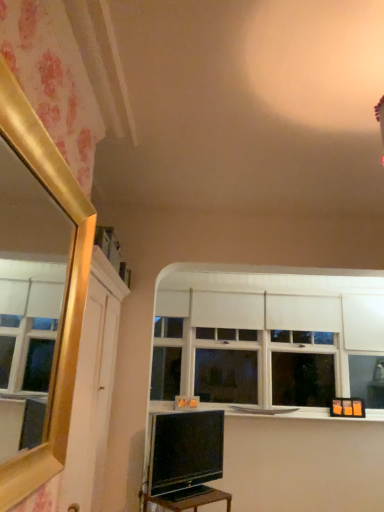
Question: Is black glossy table at lower center with matte black tv at lower center?

Choices:
 (A) yes
 (B) no

Answer: (B)

Question: Is black glossy table at lower center wider than matte black tv at lower center?

Choices:
 (A) yes
 (B) no

Answer: (A)

Question: Can you confirm if black glossy table at lower center is positioned to the left of matte black tv at lower center?

Choices:
 (A) yes
 (B) no

Answer: (A)

Question: Considering the relative sizes of black glossy table at lower center and matte black tv at lower center in the image provided, is black glossy table at lower center bigger than matte black tv at lower center?

Choices:
 (A) no
 (B) yes

Answer: (A)

Question: Is black glossy table at lower center far away from matte black tv at lower center?

Choices:
 (A) yes
 (B) no

Answer: (B)

Question: From the image's perspective, is black glossy table at lower center positioned above or below white matte window at center?

Choices:
 (A) below
 (B) above

Answer: (A)

Question: Based on their sizes in the image, would you say black glossy table at lower center is bigger or smaller than white matte window at center?

Choices:
 (A) big
 (B) small

Answer: (B)

Question: From their relative heights in the image, would you say black glossy table at lower center is taller or shorter than white matte window at center?

Choices:
 (A) tall
 (B) short

Answer: (B)

Question: Is black glossy table at lower center wider or thinner than white matte window at center?

Choices:
 (A) thin
 (B) wide

Answer: (B)

Question: Looking at their shapes, would you say white matte window sill at center is wider or thinner than white matte window at center?

Choices:
 (A) wide
 (B) thin

Answer: (A)

Question: Is white matte window sill at center in front of or behind white matte window at center in the image?

Choices:
 (A) behind
 (B) front

Answer: (B)

Question: In terms of height, does white matte window sill at center look taller or shorter compared to white matte window at center?

Choices:
 (A) short
 (B) tall

Answer: (A)

Question: Is white matte window sill at center spatially inside white matte window at center, or outside of it?

Choices:
 (A) inside
 (B) outside

Answer: (B)

Question: Considering their positions, is white matte window at center located in front of or behind black glossy table at lower center?

Choices:
 (A) behind
 (B) front

Answer: (A)

Question: Is white matte window at center taller or shorter than black glossy table at lower center?

Choices:
 (A) short
 (B) tall

Answer: (B)